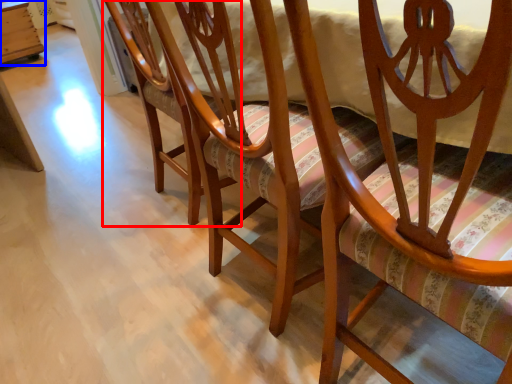
Question: Which object is further to the camera taking this photo, chair (highlighted by a red box) or table (highlighted by a blue box)?

Choices:
 (A) chair
 (B) table

Answer: (B)